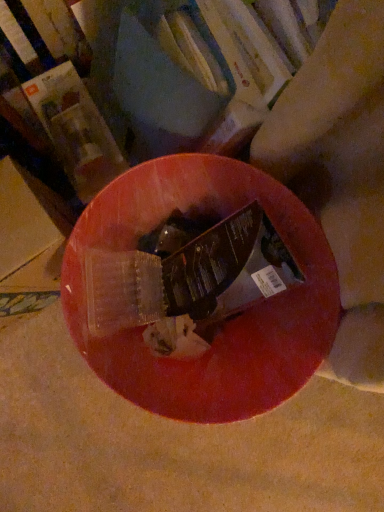
Question: From a real-world perspective, is matte plastic book at upper left, which ranks as the 2th book in right-to-left order, over hardcover book at center, placed as the second book when sorted from left to right?

Choices:
 (A) yes
 (B) no

Answer: (B)

Question: Does matte plastic book at upper left, which ranks as the 2th book in right-to-left order, have a greater height compared to hardcover book at center, placed as the second book when sorted from left to right?

Choices:
 (A) no
 (B) yes

Answer: (A)

Question: Is matte plastic book at upper left, which ranks as the 2th book in right-to-left order, surrounding hardcover book at center, which is counted as the first book, starting from the right?

Choices:
 (A) no
 (B) yes

Answer: (A)

Question: Is the depth of matte plastic book at upper left, which ranks as the 2th book in right-to-left order, less than that of hardcover book at center, placed as the second book when sorted from left to right?

Choices:
 (A) no
 (B) yes

Answer: (A)

Question: From a real-world perspective, is matte plastic book at upper left, which ranks as the 2th book in right-to-left order, beneath hardcover book at center, which is counted as the first book, starting from the right?

Choices:
 (A) yes
 (B) no

Answer: (A)

Question: Is matte plastic book at upper left, the first book positioned from the left, positioned with its back to hardcover book at center, placed as the second book when sorted from left to right?

Choices:
 (A) yes
 (B) no

Answer: (B)

Question: From the image's perspective, is hardcover book at center, placed as the second book when sorted from left to right, on top of matte plastic book at upper left, the first book positioned from the left?

Choices:
 (A) yes
 (B) no

Answer: (A)

Question: Is hardcover book at center, placed as the second book when sorted from left to right, smaller than matte plastic book at upper left, which ranks as the 2th book in right-to-left order?

Choices:
 (A) no
 (B) yes

Answer: (A)

Question: Does hardcover book at center, placed as the second book when sorted from left to right, have a lesser width compared to matte plastic book at upper left, which ranks as the 2th book in right-to-left order?

Choices:
 (A) yes
 (B) no

Answer: (A)

Question: Is hardcover book at center, placed as the second book when sorted from left to right, with matte plastic book at upper left, the first book positioned from the left?

Choices:
 (A) no
 (B) yes

Answer: (B)

Question: Is hardcover book at center, placed as the second book when sorted from left to right, positioned with its back to matte plastic book at upper left, the first book positioned from the left?

Choices:
 (A) no
 (B) yes

Answer: (A)

Question: Considering the relative sizes of hardcover book at center, which is counted as the first book, starting from the right, and matte plastic book at upper left, the first book positioned from the left, in the image provided, is hardcover book at center, which is counted as the first book, starting from the right, taller than matte plastic book at upper left, the first book positioned from the left,?

Choices:
 (A) no
 (B) yes

Answer: (B)

Question: Do you think matte plastic book at upper left, the first book positioned from the left, is within hardcover book at center, which is counted as the first book, starting from the right, or outside of it?

Choices:
 (A) outside
 (B) inside

Answer: (A)